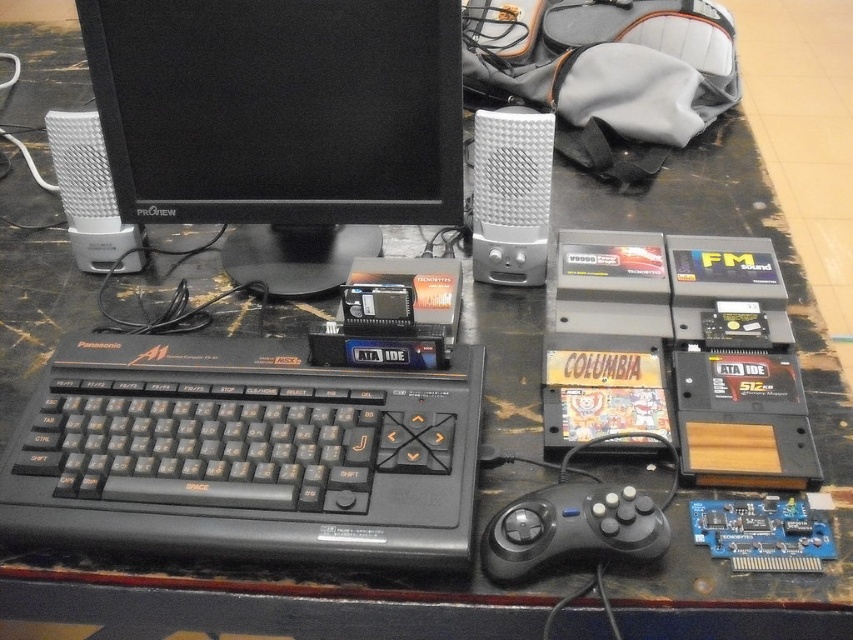
Question: Is black plastic computer at center wider than silver textured speaker at center?

Choices:
 (A) yes
 (B) no

Answer: (A)

Question: Which of the following is the closest to the observer?

Choices:
 (A) black plastic monitor at upper center
 (B) silver textured speaker at center
 (C) white plastic speaker at center

Answer: (A)

Question: Which of the following is the farthest from the observer?

Choices:
 (A) white plastic speaker at center
 (B) silver textured speaker at center
 (C) black plastic keyboard at center
 (D) black plastic monitor at upper center

Answer: (A)

Question: Does black plastic keyboard at center appear under black matte game controller at lower center?

Choices:
 (A) yes
 (B) no

Answer: (B)

Question: Estimate the real-world distances between objects in this image. Which object is closer to the black plastic keyboard at center?

Choices:
 (A) white plastic speaker at center
 (B) black matte game controller at lower center
 (C) black plastic monitor at upper center

Answer: (B)

Question: Is black plastic keyboard at center bigger than silver textured speaker at center?

Choices:
 (A) no
 (B) yes

Answer: (B)